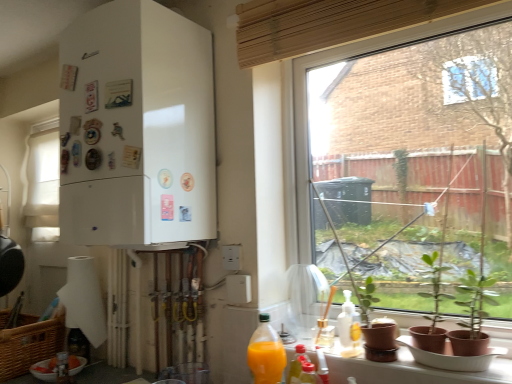
Question: Would you say transparent glass window at center, which is counted as the first window, starting from the right, is inside or outside white fabric curtain at left, the 2th window when ordered from right to left?

Choices:
 (A) inside
 (B) outside

Answer: (B)

Question: From their relative heights in the image, would you say transparent glass window at center, which is counted as the first window, starting from the right, is taller or shorter than white fabric curtain at left, the 2th window when ordered from right to left?

Choices:
 (A) short
 (B) tall

Answer: (B)

Question: Estimate the real-world distances between objects in this image. Which object is closer to the translucent plastic bottle at lower left, the 1th bottle positioned from the left?

Choices:
 (A) white matte refrigerator at left
 (B) woven brown picnic basket at lower left
 (C) white matte bowl at lower left
 (D) translucent plastic bottle at lower right, positioned as the 1th bottle in front-to-back order
 (E) translucent orange juice at lower right, which is the 2th bottle in left-to-right order

Answer: (C)

Question: Which object is the farthest from the white matte bowl at lower left?

Choices:
 (A) matte brown pots at lower right
 (B) translucent plastic bottle at lower center, the 2th bottle when ordered from right to left
 (C) woven brown picnic basket at lower left
 (D) green matte plant at lower right
 (E) translucent plastic bottle at lower left, the fourth bottle positioned from the right

Answer: (D)